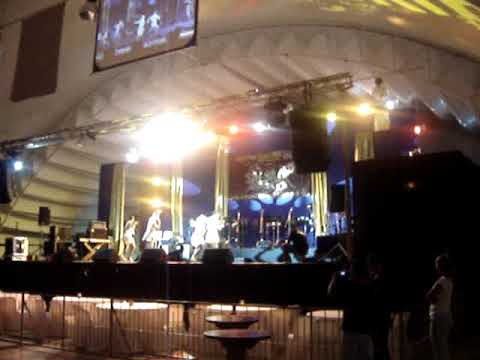
Find the location of a particular element. Image resolution: width=480 pixels, height=360 pixels. musical keyboard is located at coordinates (97, 240).